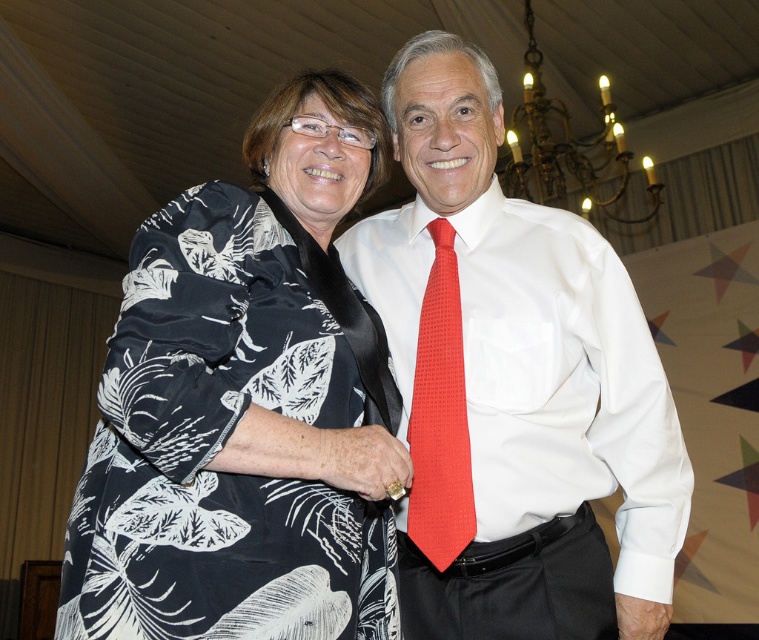
You are taking a photo of two people at a formal event. You notice two points in the image labeled as point (442,173) and point (411,410). Which point is closer to the camera?

Point (442,173) is closer to the camera than point (411,410).

You are a photographer at a formal event. You need to ensure that the white smooth shirt at center and the black floral fabric dress at left are both visible in your photo. Given their sizes, which one might you need to adjust your camera angle to fully capture?

The white smooth shirt at center is larger in size than the black floral fabric dress at left, so you might need to adjust your camera angle to fully capture the white smooth shirt at center due to its larger size.